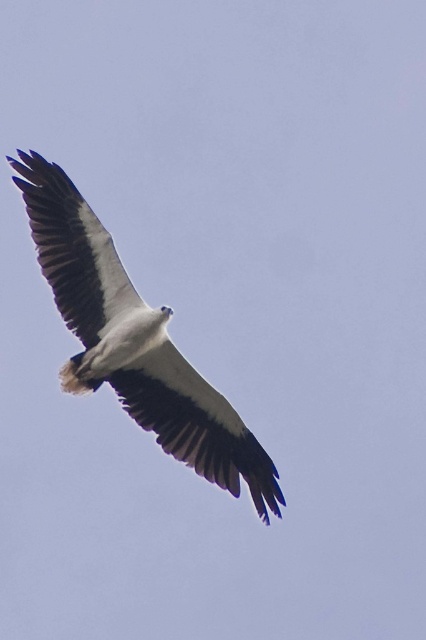
Is the position of white feathered eagle at center less distant than that of white feathered wing at upper left?

Yes, white feathered eagle at center is closer to the viewer.

Which is behind, point (207, 413) or point (19, 156)?

Positioned behind is point (19, 156).

I want to click on white feathered eagle at center, so [x=134, y=340].

Who is positioned more to the right, white feathered eagle at center or white feathered wing at center?

Positioned to the right is white feathered wing at center.

Where is `white feathered eagle at center`? The height and width of the screenshot is (640, 426). white feathered eagle at center is located at coordinates (134, 340).

Between point (256, 460) and point (111, 323), which one is positioned behind?

Point (256, 460)

Is the position of white feathered wing at center more distant than that of white feathered wing at upper left?

No, white feathered wing at center is in front of white feathered wing at upper left.

Image resolution: width=426 pixels, height=640 pixels. I want to click on white feathered wing at center, so point(195,424).

Find the location of a particular element. white feathered wing at center is located at coordinates (195, 424).